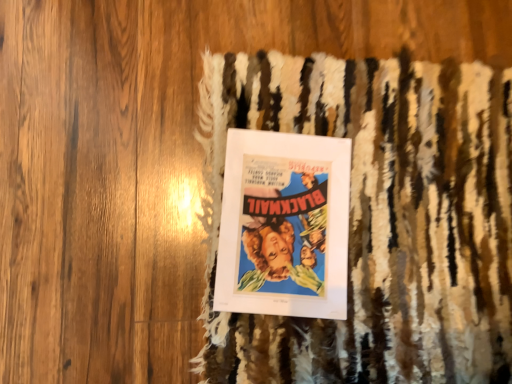
Measure the distance between point (259, 177) and camera.

The depth of point (259, 177) is 69.60 centimeters.

This screenshot has height=384, width=512. Describe the element at coordinates (284, 225) in the screenshot. I see `vibrant paper poster at center` at that location.

In order to face vibrant paper poster at center, should I rotate leftwards or rightwards?

Rotate right and turn 3.893 degrees.

Measure the distance between vibrant paper poster at center and camera.

26.10 inches.

Locate an element on the screen. vibrant paper poster at center is located at coordinates click(284, 225).

What are the coordinates of `vibrant paper poster at center` in the screenshot? It's located at (284, 225).